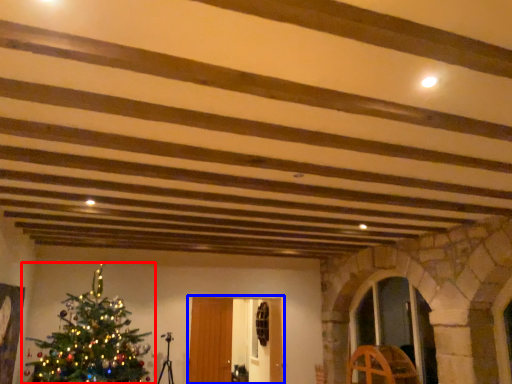
Question: Which of the following is the closest to the observer, christmas tree (highlighted by a red box) or glass door (highlighted by a blue box)?

Choices:
 (A) christmas tree
 (B) glass door

Answer: (A)